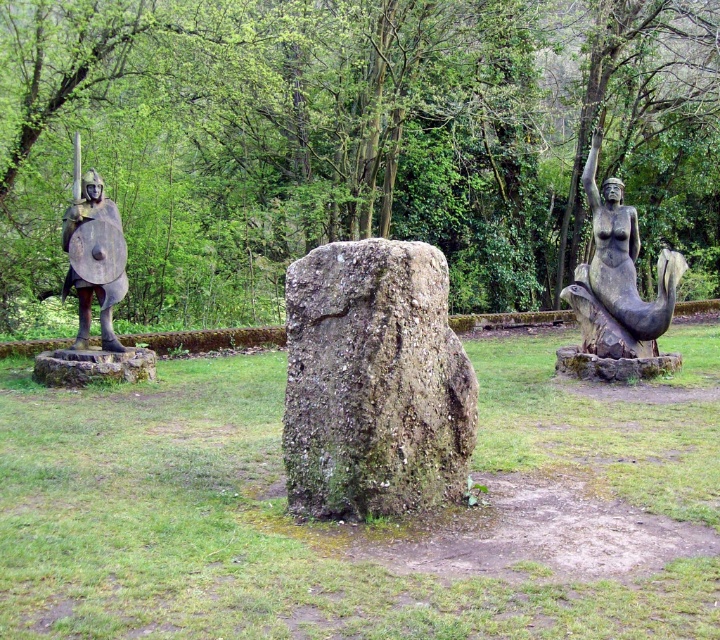
Which is above, bronze mermaid at right or bronze warrior at left?

bronze warrior at left is above.

Does bronze mermaid at right lie in front of bronze warrior at left?

No, bronze mermaid at right is behind bronze warrior at left.

Is point (638, 336) closer to camera compared to point (76, 140)?

That is False.

This screenshot has width=720, height=640. I want to click on bronze mermaid at right, so click(616, 289).

Between green mossy rock at center and bronze mermaid at right, which one appears on the left side from the viewer's perspective?

From the viewer's perspective, green mossy rock at center appears more on the left side.

Does point (445, 467) lie behind point (613, 372)?

No, it is in front of (613, 372).

The image size is (720, 640). Identify the location of green mossy rock at center. (373, 381).

Does green mossy rock at center appear on the left side of bronze warrior at left?

Incorrect, green mossy rock at center is not on the left side of bronze warrior at left.

Between point (408, 364) and point (90, 189), which one is positioned behind?

The point (90, 189) is behind.

Does point (325, 472) come in front of point (102, 259)?

Yes, point (325, 472) is in front of point (102, 259).

The height and width of the screenshot is (640, 720). Identify the location of green mossy rock at center. (373, 381).